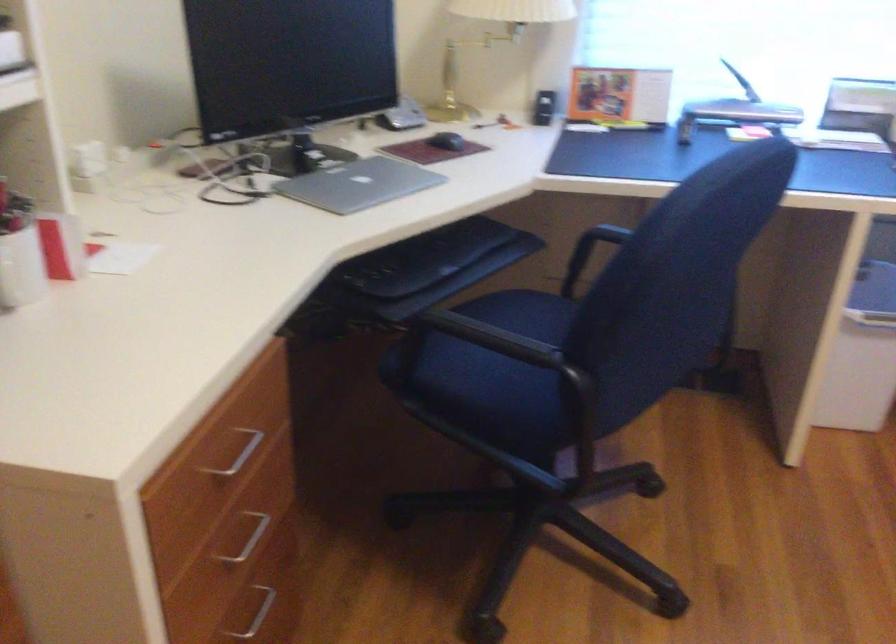
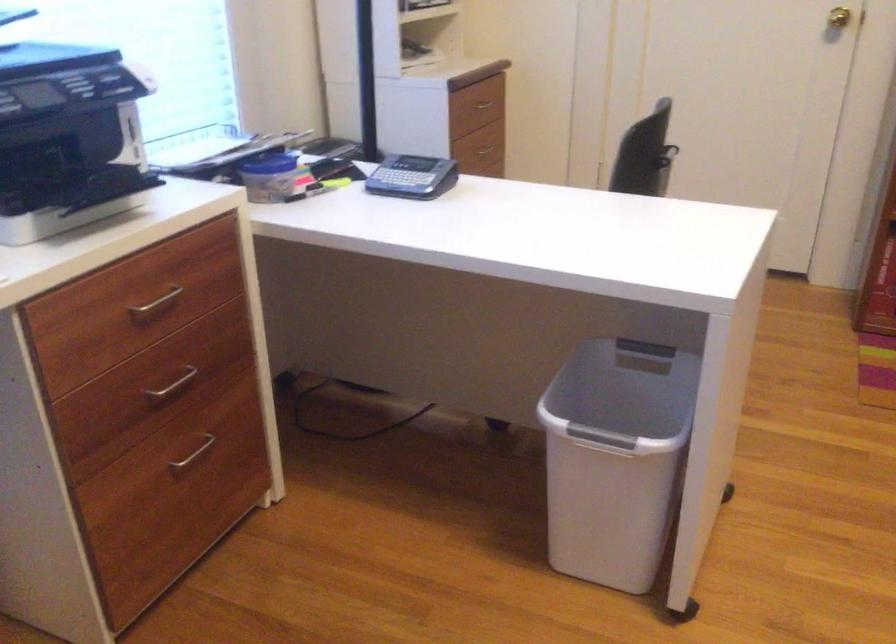
Based on the continuous images, in which direction is the camera rotating?

The camera rotated toward right-down.